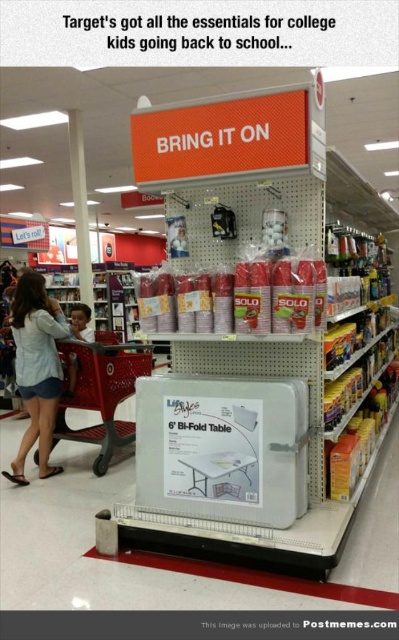
You are a customer in a Target store holding a 12 inch wide box. You want to place it between the plastic shopping cart at lower left and the brown leather jacket at lower left. Is there enough space?

The distance between the plastic shopping cart at lower left and brown leather jacket at lower left is 25.56 inches. Since the box is 12 inches wide, there is sufficient space to place it between them.